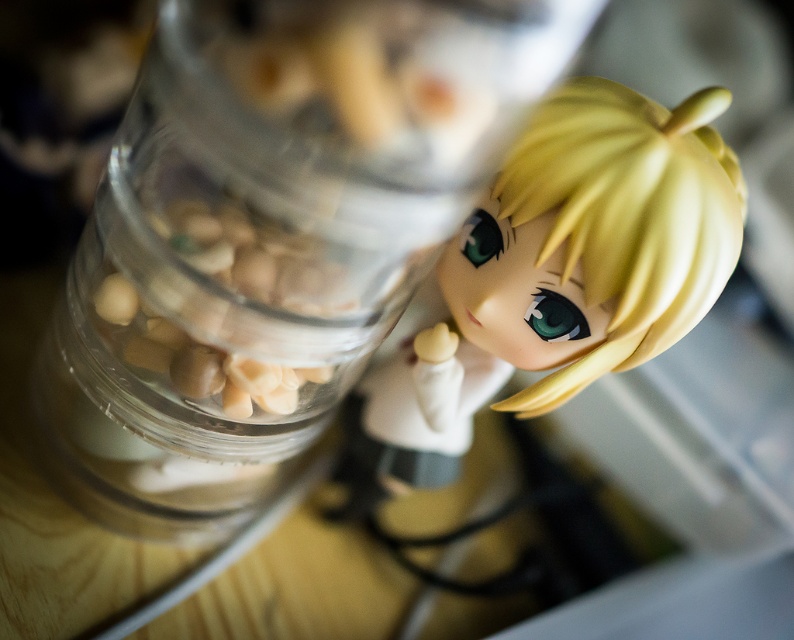
In the scene shown: You are a photographer trying to capture a closeup shot of the transparent glass jar at upper center and the satin blonde doll at upper right. Your camera can focus on objects within a 2.5 inch range. Can both objects be in focus at the same time?

The distance between the transparent glass jar at upper center and the satin blonde doll at upper right is 3.04 inches. Since the camera can only focus within a 2.5 inch range, both objects cannot be in focus simultaneously.

You are arranging items on a shelf and need to know the vertical position of the transparent glass jar at upper center and the translucent glass jar at upper left. Which one is higher up?

The transparent glass jar at upper center is higher up than the translucent glass jar at upper left because it is located above it.

Consider the image. You are a photographer setting up a shot. You have a satin blonde doll at upper right and a translucent glass jar at upper left. Which object should you adjust to ensure both are in frame? Explain your reasoning.

The satin blonde doll at upper right is much taller than the translucent glass jar at upper left. To ensure both are in frame, you should adjust the angle or position of the satin blonde doll at upper right since it is taller and might be blocking the view of the translucent glass jar at upper left or requiring a wider shot to accommodate its height.